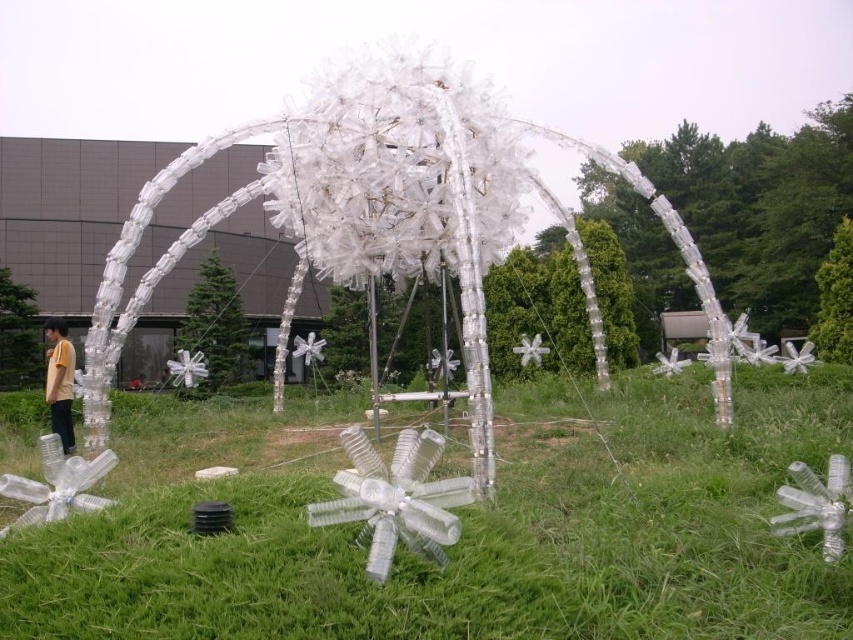
You are standing at the origin point of the coordinate system. The transparent plastic sculpture at center is located at point 0.331, 0.461. If you want to walk directly towards it, which direction should you head?

Since the transparent plastic sculpture at center is located at coordinates (392,211), you should head northeast to reach it directly.

You are standing in the park and see the transparent plastic flower at center and the yellow matte shirt at lower left. Which object is positioned to the right side from your perspective?

The transparent plastic flower at center is positioned to the right of the yellow matte shirt at lower left.

You are an artist visiting the installation and want to take a photo of the transparent plastic flower at center and the transparent plastic sculpture at center. Which one should you focus on first if you want to capture both in the same frame without moving the camera?

The transparent plastic flower at center is positioned on the right side of the transparent plastic sculpture at center, so you should focus on the transparent plastic sculpture at center first to ensure both are in the frame.